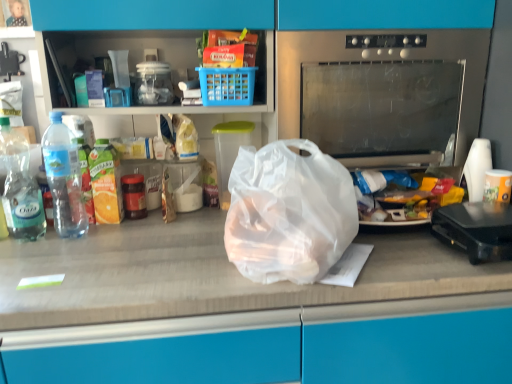
Question: From a real-world perspective, relative to clear plastic bottle at left, the 2th bottle when ordered from right to left, is translucent plastic bag at center vertically above or below?

Choices:
 (A) below
 (B) above

Answer: (A)

Question: Is translucent plastic bag at center to the left or to the right of clear plastic bottle at left, the 2th bottle when ordered from right to left, in the image?

Choices:
 (A) right
 (B) left

Answer: (A)

Question: Estimate the real-world distances between objects in this image. Which object is closer to the stainless steel oven at center?

Choices:
 (A) transparent plastic container at center
 (B) translucent plastic bag at center
 (C) clear plastic bottle at left, which is the first bottle from left to right
 (D) black plastic toaster at right
 (E) clear plastic bottle at left, positioned as the first bottle in right-to-left order

Answer: (D)

Question: Which of these objects is positioned closest to the transparent plastic container at center?

Choices:
 (A) translucent plastic bag at center
 (B) transparent plastic bag at center
 (C) stainless steel oven at center
 (D) black plastic toaster at right
 (E) clear plastic bottle at left, positioned as the first bottle in right-to-left order

Answer: (B)